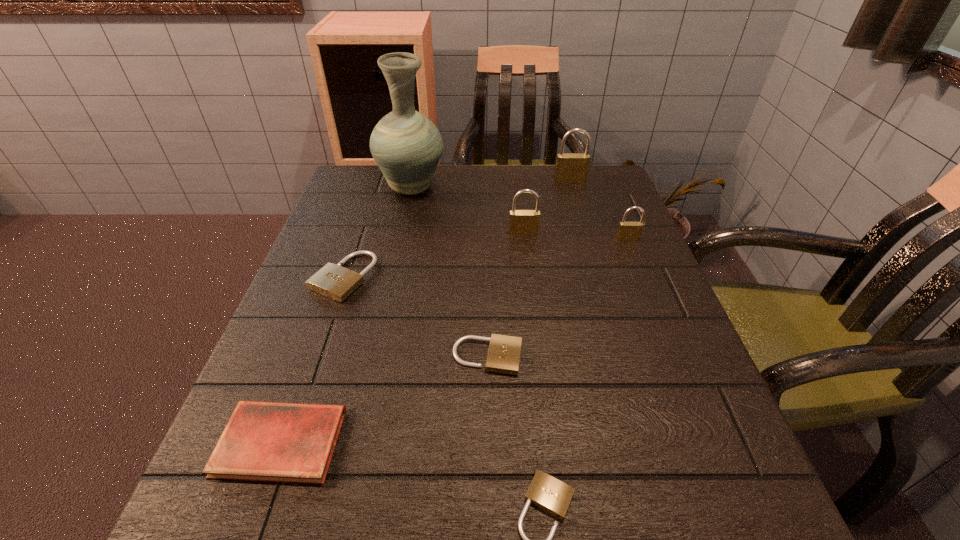
At what (x,y) coordinates should I click in order to perform the action: click on the second smallest beige padlock. Please return your answer as a coordinate pair (x, y). Looking at the image, I should click on (504, 351).

Find the location of `red diary`. red diary is located at coordinates (263, 441).

Find the location of `free space located on the front-facing side of the tallest padlock`. free space located on the front-facing side of the tallest padlock is located at coordinates (584, 224).

This screenshot has width=960, height=540. What are the coordinates of `vacant space located 0.370m on the front-facing side of the leftmost brass padlock` in the screenshot? It's located at (540, 363).

You are a GUI agent. You are given a task and a screenshot of the screen. Output one action in this format:
    pyautogui.click(x=<x>, y=<y>)
    Task: Click on the free space located on the front-facing side of the rightmost padlock
    Image resolution: width=960 pixels, height=540 pixels.
    Given the screenshot: What is the action you would take?
    pyautogui.click(x=636, y=258)

Identify the location of vacant space located on the back of the third shortest padlock. (361, 225).

I want to click on free space located 0.110m on the back of the second smallest beige padlock, so click(487, 297).

Where is `vacant position located 0.180m on the back of the red diary`? Image resolution: width=960 pixels, height=540 pixels. vacant position located 0.180m on the back of the red diary is located at coordinates (324, 321).

Locate an element on the screen. pitcher situated at the far edge is located at coordinates (406, 145).

Where is `padlock at the far edge`? Image resolution: width=960 pixels, height=540 pixels. padlock at the far edge is located at coordinates (570, 167).